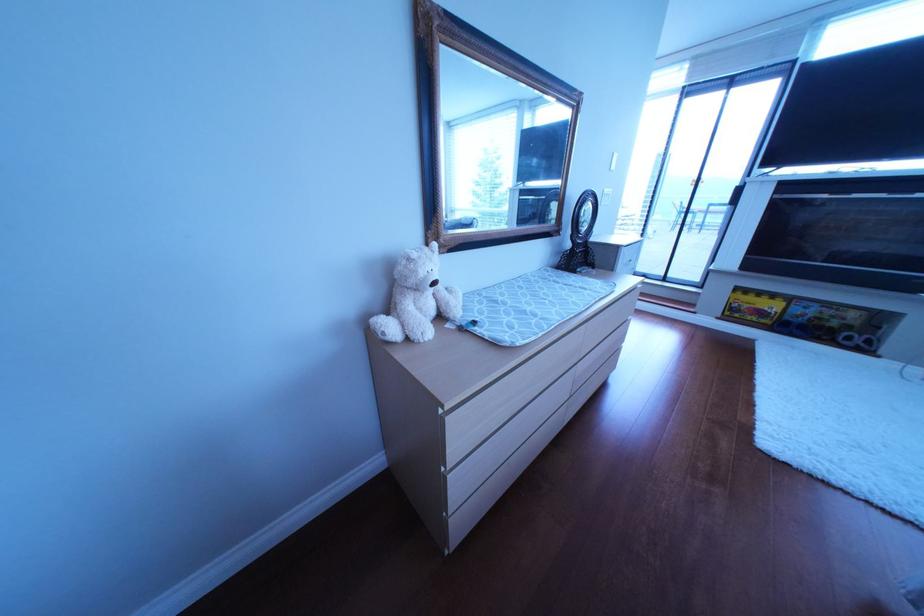
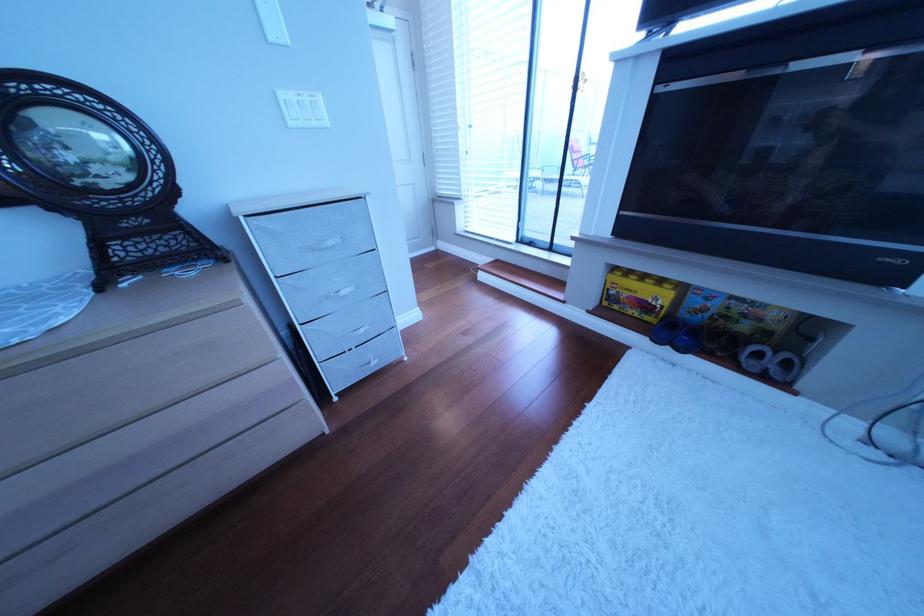
Find the pixel in the second image that matches pixel 786 322 in the first image.

(672, 320)